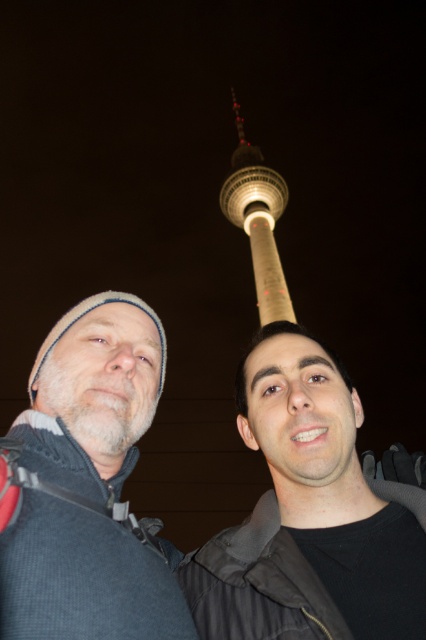
Question: Which object is the closest to the dark gray knit hat at upper left?

Choices:
 (A) white concrete tower at upper center
 (B) gray knit beanie at left

Answer: (B)

Question: Is dark gray knit hat at upper left bigger than white concrete tower at upper center?

Choices:
 (A) yes
 (B) no

Answer: (B)

Question: Estimate the real-world distances between objects in this image. Which object is closer to the dark gray knit hat at upper left?

Choices:
 (A) white concrete tower at upper center
 (B) gray knit beanie at left

Answer: (B)

Question: Which point appears farthest from the camera in this image?

Choices:
 (A) (143, 586)
 (B) (135, 314)
 (C) (288, 310)

Answer: (C)

Question: Is dark gray knit hat at upper left to the left of gray knit beanie at left from the viewer's perspective?

Choices:
 (A) no
 (B) yes

Answer: (A)

Question: Observing the image, what is the correct spatial positioning of gray knit beanie at left in reference to white concrete tower at upper center?

Choices:
 (A) right
 (B) left

Answer: (B)